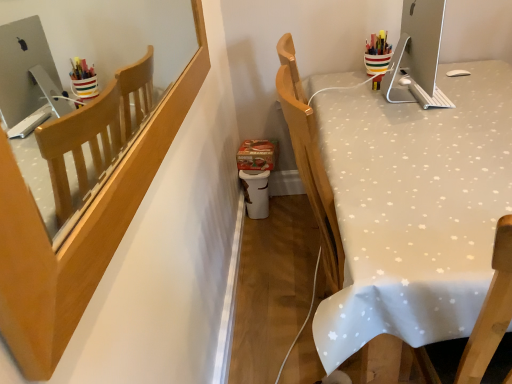
Question: From the image's perspective, is satin silver monitor at upper right located above or below wooden chair back at upper left?

Choices:
 (A) below
 (B) above

Answer: (B)

Question: Would you say satin silver monitor at upper right is to the left or to the right of wooden chair back at upper left in the picture?

Choices:
 (A) left
 (B) right

Answer: (B)

Question: Which object is the farthest from the wooden chair back at upper left?

Choices:
 (A) white fabric-covered desk at right
 (B) satin silver monitor at upper right

Answer: (B)

Question: Estimate the real-world distances between objects in this image. Which object is closer to the wooden chair back at upper left?

Choices:
 (A) white fabric-covered desk at right
 (B) satin silver monitor at upper right

Answer: (A)